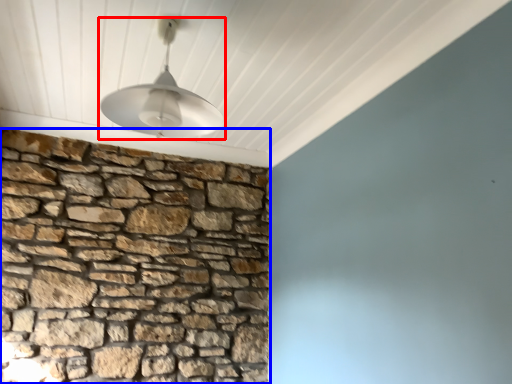
Question: Which object appears farthest to the camera in this image, lamp (highlighted by a red box) or brickwork (highlighted by a blue box)?

Choices:
 (A) lamp
 (B) brickwork

Answer: (B)